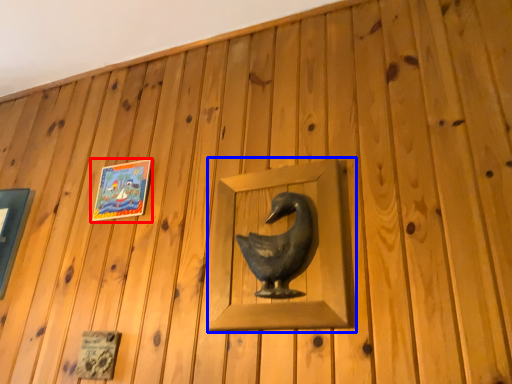
Question: Which of the following is the closest to the observer, picture frame (highlighted by a red box) or sculpture (highlighted by a blue box)?

Choices:
 (A) picture frame
 (B) sculpture

Answer: (B)